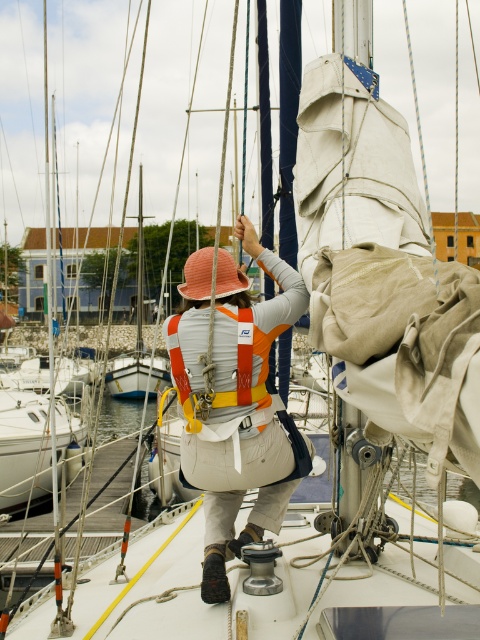
You are a sailor on the docked sailboat and need to quickly grab either the orange fabric life vest at center or the orange fabric safety vest at center. Which one is taller and easier to reach without bending down?

The orange fabric life vest at center is much taller than the orange fabric safety vest at center, so it would be easier to reach without bending down.

You are a sailor on the docked sailboat and need to quickly access either the orange fabric life vest at center or the orange fabric safety vest at center. Which one is easier to reach based on their positions?

The orange fabric life vest at center is located below the orange fabric safety vest at center, so it is easier to reach because it is closer to the sailor.